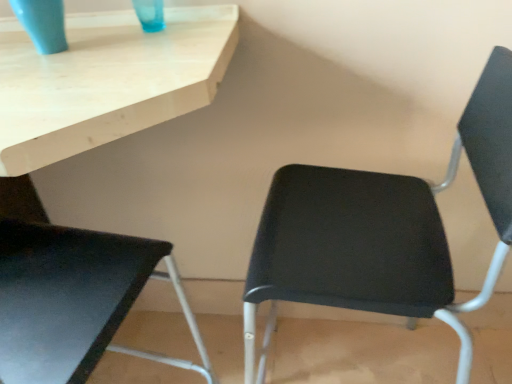
Question: Is black plastic chair at center, positioned as the 2th chair in left-to-right order, located within matte blue glass at upper left?

Choices:
 (A) no
 (B) yes

Answer: (A)

Question: From the image's perspective, is matte blue glass at upper left located beneath black plastic chair at center, which is the first chair from right to left?

Choices:
 (A) yes
 (B) no

Answer: (B)

Question: Is matte blue glass at upper left wider than black plastic chair at center, which is the first chair from right to left?

Choices:
 (A) no
 (B) yes

Answer: (A)

Question: From the image's perspective, is matte blue glass at upper left over black plastic chair at center, which is the first chair from right to left?

Choices:
 (A) no
 (B) yes

Answer: (B)

Question: Does matte blue glass at upper left appear on the right side of black plastic chair at center, positioned as the 2th chair in left-to-right order?

Choices:
 (A) no
 (B) yes

Answer: (A)

Question: Is black plastic chair at center, which is the first chair from right to left, bigger or smaller than matte black chair at lower left, which appears as the 2th chair when viewed from the right?

Choices:
 (A) big
 (B) small

Answer: (B)

Question: Visually, is black plastic chair at center, which is the first chair from right to left, positioned to the left or to the right of matte black chair at lower left, which is counted as the first chair, starting from the left?

Choices:
 (A) right
 (B) left

Answer: (A)

Question: Is point (367, 264) positioned closer to the camera than point (87, 273)?

Choices:
 (A) closer
 (B) farther

Answer: (A)

Question: Relative to matte black chair at lower left, which is counted as the first chair, starting from the left, is black plastic chair at center, positioned as the 2th chair in left-to-right order, in front or behind?

Choices:
 (A) behind
 (B) front

Answer: (A)

Question: Is matte black chair at lower left, which is counted as the first chair, starting from the left, in front of or behind matte blue glass at upper left in the image?

Choices:
 (A) behind
 (B) front

Answer: (B)

Question: Is matte black chair at lower left, which is counted as the first chair, starting from the left, wider or thinner than matte blue glass at upper left?

Choices:
 (A) wide
 (B) thin

Answer: (A)

Question: Which is correct: matte black chair at lower left, which is counted as the first chair, starting from the left, is inside matte blue glass at upper left, or outside of it?

Choices:
 (A) outside
 (B) inside

Answer: (A)

Question: Is point (37, 271) positioned closer to the camera than point (60, 18)?

Choices:
 (A) farther
 (B) closer

Answer: (A)

Question: From the image's perspective, relative to black plastic chair at center, which is the first chair from right to left, is matte blue glass at upper left above or below?

Choices:
 (A) below
 (B) above

Answer: (B)

Question: Considering their positions, is matte blue glass at upper left located in front of or behind black plastic chair at center, positioned as the 2th chair in left-to-right order?

Choices:
 (A) behind
 (B) front

Answer: (A)